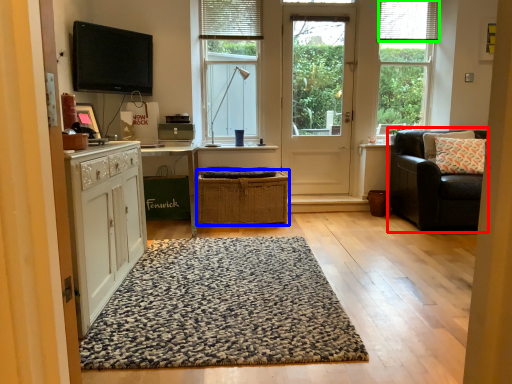
Question: Estimate the real-world distances between objects in this image. Which object is closer to chair (highlighted by a red box), crate (highlighted by a blue box) or blind (highlighted by a green box)?

Choices:
 (A) crate
 (B) blind

Answer: (A)